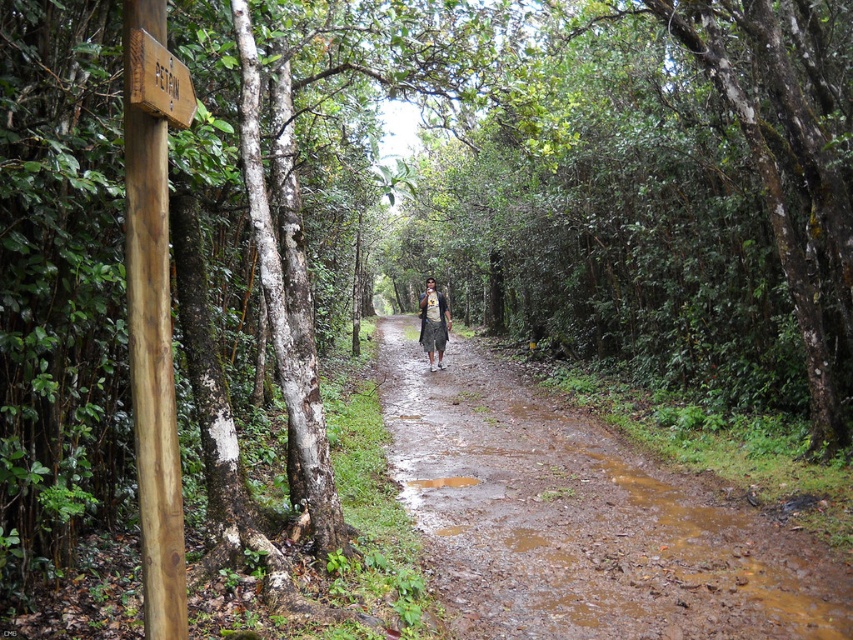
You are hiking along the muddy path and notice the brown wooden signpost at left and the camouflage fabric shirt at center. Which object is bigger in size?

The brown wooden signpost at left is larger in size compared to the camouflage fabric shirt at center.

You are hiking along the muddy dirt path at center and notice a camouflage fabric shirt at center lying on the ground. If you want to pick up the shirt, which direction should you move relative to the path?

The camouflage fabric shirt at center is to the left of the muddy dirt path at center, so you should move to your left to pick it up.